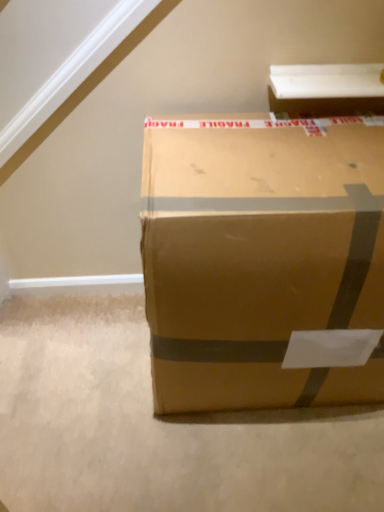
This screenshot has height=512, width=384. What do you see at coordinates (264, 261) in the screenshot?
I see `brown cardboard box at center` at bounding box center [264, 261].

Where is `brown cardboard box at center`? This screenshot has width=384, height=512. brown cardboard box at center is located at coordinates (264, 261).

Locate an element on the screen. Image resolution: width=384 pixels, height=512 pixels. brown cardboard box at center is located at coordinates (264, 261).